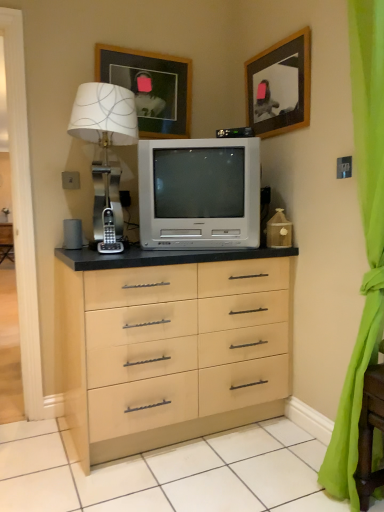
Question: Does white plastic television at center have a larger size compared to metallic silver table lamp at left?

Choices:
 (A) yes
 (B) no

Answer: (A)

Question: From the image's perspective, is white plastic television at center located above metallic silver table lamp at left?

Choices:
 (A) no
 (B) yes

Answer: (A)

Question: Does white plastic television at center turn towards metallic silver table lamp at left?

Choices:
 (A) yes
 (B) no

Answer: (B)

Question: From a real-world perspective, is white plastic television at center physically below metallic silver table lamp at left?

Choices:
 (A) yes
 (B) no

Answer: (A)

Question: Does white plastic television at center touch metallic silver table lamp at left?

Choices:
 (A) yes
 (B) no

Answer: (B)

Question: From a real-world perspective, does white plastic television at center stand above metallic silver table lamp at left?

Choices:
 (A) no
 (B) yes

Answer: (A)

Question: Considering the relative sizes of metallic silver table lamp at left and white plastic television at center in the image provided, is metallic silver table lamp at left taller than white plastic television at center?

Choices:
 (A) no
 (B) yes

Answer: (B)

Question: Is metallic silver table lamp at left outside white plastic television at center?

Choices:
 (A) no
 (B) yes

Answer: (B)

Question: Does metallic silver table lamp at left have a larger size compared to white plastic television at center?

Choices:
 (A) yes
 (B) no

Answer: (B)

Question: From the image's perspective, does metallic silver table lamp at left appear lower than white plastic television at center?

Choices:
 (A) yes
 (B) no

Answer: (B)

Question: From the image's perspective, would you say metallic silver table lamp at left is positioned over white plastic television at center?

Choices:
 (A) no
 (B) yes

Answer: (B)

Question: Does metallic silver table lamp at left touch white plastic television at center?

Choices:
 (A) no
 (B) yes

Answer: (A)

Question: Does wooden framed picture at upper center, the 2th picture frame from the right, have a lesser height compared to wooden picture frame at upper center, which appears as the 1th picture frame when viewed from the right?

Choices:
 (A) yes
 (B) no

Answer: (A)